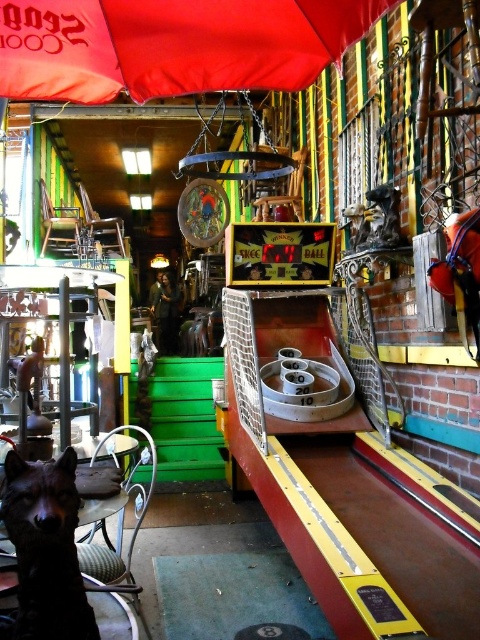
Identify the location of red fabric umbrella at upper center. (172, 45).

Is point (324, 60) in front of point (50, 465)?

No, (324, 60) is behind (50, 465).

Where is `red fabric umbrella at upper center`? The image size is (480, 640). red fabric umbrella at upper center is located at coordinates (172, 45).